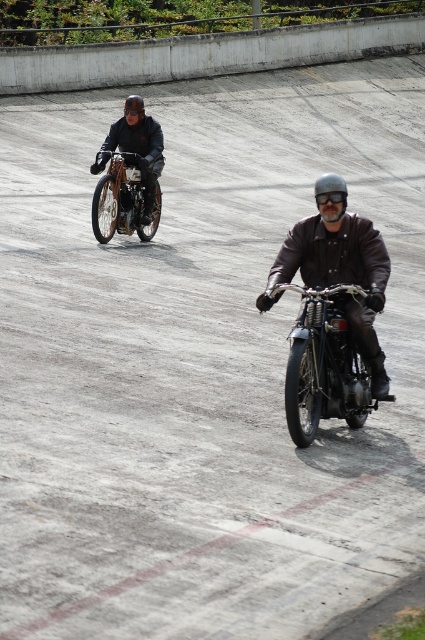
Question: In this image, where is leather jacket at center located relative to shiny chrome motorcycle at upper left?

Choices:
 (A) below
 (B) above

Answer: (A)

Question: Is leather jacket at center in front of brushed metal helmet at upper center?

Choices:
 (A) yes
 (B) no

Answer: (A)

Question: Does shiny chrome motorcycle at upper left appear on the left side of shiny silver helmet at center?

Choices:
 (A) yes
 (B) no

Answer: (A)

Question: Among these objects, which one is farthest from the camera?

Choices:
 (A) leather jacket at center
 (B) shiny silver helmet at center
 (C) shiny chrome motorcycle at upper left

Answer: (C)

Question: Which is farther from the brushed metal helmet at upper center?

Choices:
 (A) shiny silver helmet at center
 (B) shiny chrome motorcycle at center
 (C) shiny chrome motorcycle at upper left

Answer: (B)

Question: Which of these objects is positioned closest to the shiny chrome motorcycle at upper left?

Choices:
 (A) shiny chrome motorcycle at center
 (B) brushed metal helmet at upper center
 (C) leather jacket at center

Answer: (B)